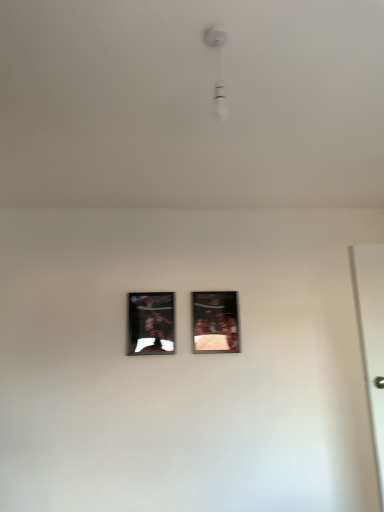
Question: From a real-world perspective, relative to metallic silver picture frame at center, which appears as the second picture frame when viewed from the left, is white glossy bulb at upper center vertically above or below?

Choices:
 (A) above
 (B) below

Answer: (A)

Question: Based on their sizes in the image, would you say white glossy bulb at upper center is bigger or smaller than metallic silver picture frame at center, which is counted as the 1th picture frame, starting from the right?

Choices:
 (A) small
 (B) big

Answer: (A)

Question: Considering the real-world distances, which object is farthest from the metallic silver picture frame at center, which appears as the second picture frame when viewed from the left?

Choices:
 (A) metallic reflective frame at center, which is counted as the second picture frame, starting from the right
 (B) white glossy bulb at upper center

Answer: (B)

Question: Which is farther from the metallic silver picture frame at center, which is counted as the 1th picture frame, starting from the right?

Choices:
 (A) metallic reflective frame at center, which is counted as the second picture frame, starting from the right
 (B) white glossy bulb at upper center

Answer: (B)